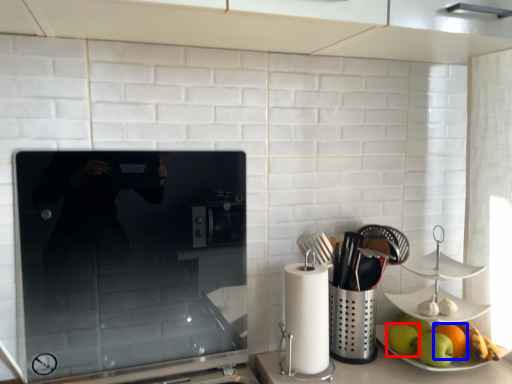
Question: Which of the following is the farthest to the observer, apple (highlighted by a red box) or orange (highlighted by a blue box)?

Choices:
 (A) apple
 (B) orange

Answer: (A)